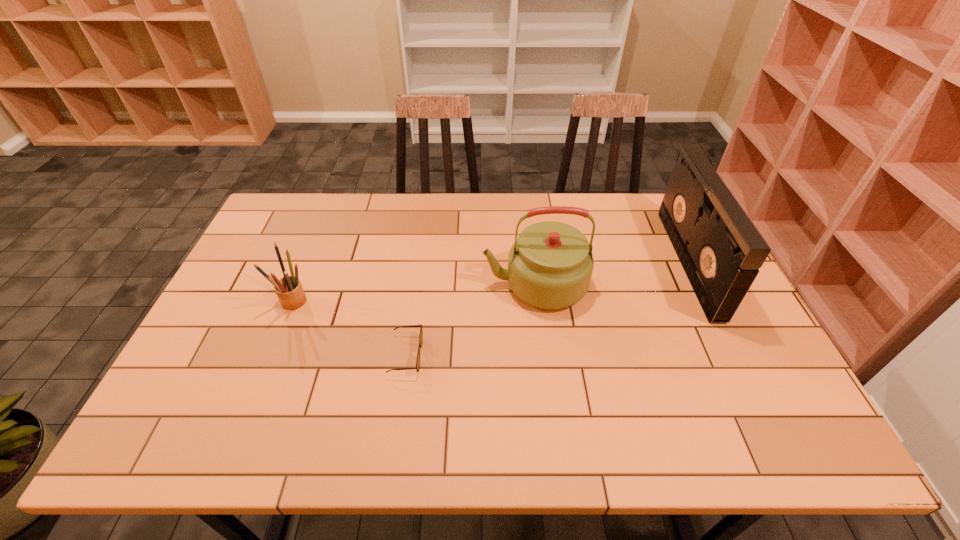
Find the location of a particular element. The height and width of the screenshot is (540, 960). the second object from right to left is located at coordinates (550, 265).

You are a GUI agent. You are given a task and a screenshot of the screen. Output one action in this format:
    pyautogui.click(x=<x>, y=<y>)
    Task: Click on the videotape
    This screenshot has height=540, width=960.
    Given the screenshot: What is the action you would take?
    pyautogui.click(x=721, y=251)

The width and height of the screenshot is (960, 540). In order to click on the leftmost object in this screenshot , I will do `click(289, 290)`.

Where is `pencil box`? The image size is (960, 540). pencil box is located at coordinates (289, 290).

This screenshot has width=960, height=540. Identify the location of the third object from right to left. (417, 367).

Image resolution: width=960 pixels, height=540 pixels. Identify the location of the shortest object. (417, 367).

Identify the location of blank space located 0.150m at the spout of the kettle. Image resolution: width=960 pixels, height=540 pixels. (431, 284).

I want to click on free space located at the spout of the kettle, so click(x=466, y=284).

The width and height of the screenshot is (960, 540). I want to click on vacant space located at the spout of the kettle, so click(347, 284).

I want to click on vacant area located 0.240m on the front side of the rightmost object, so click(x=603, y=262).